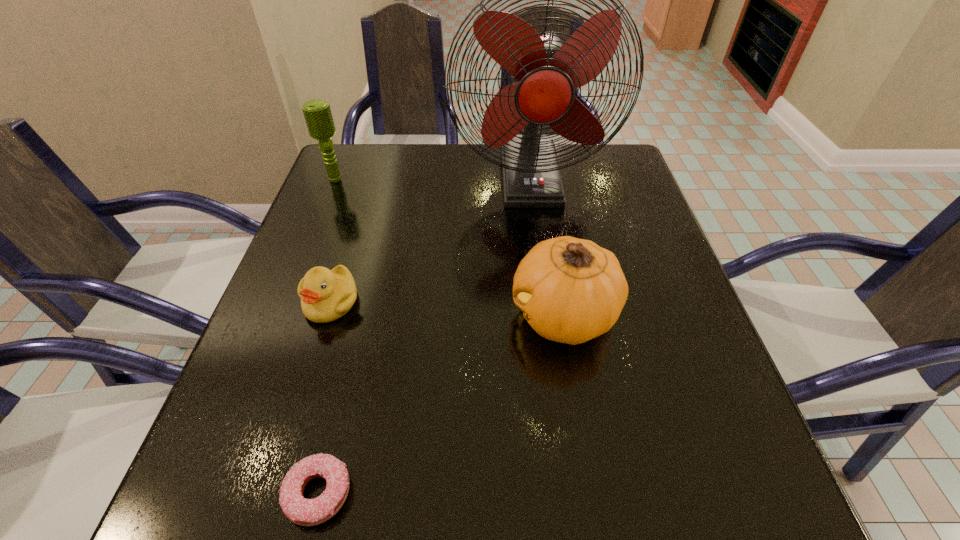
At what (x,y) coordinates should I click in order to perform the action: click on the fourth closest object to the nearest object. Please return your answer as a coordinate pair (x, y). This screenshot has width=960, height=540. Looking at the image, I should click on (317, 113).

Choose which object is the nearest neighbor to the pumpkin. Please provide its 2D coordinates. Your answer should be formatted as a tuple, i.e. [(x, y)], where the tuple contains the x and y coordinates of a point satisfying the conditions above.

[(544, 73)]

At what (x,y) coordinates should I click in order to perform the action: click on vacant point that satisfies the following two spatial constraints: 1. on the front-facing side of the shortest object; 2. on the right side of the fourth tallest object. Please return your answer as a coordinate pair (x, y). Looking at the image, I should click on (272, 492).